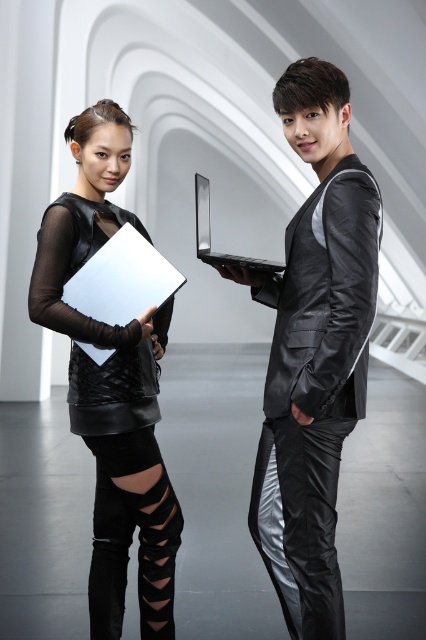
You are an interior designer observing the modern setting. You need to place a new decorative sculpture that requires a stable, flat surface. Which object between the shiny black leather jacket at center and the white matte clipboard at left would be the better choice for placing the sculpture?

The white matte clipboard at left is shorter than the shiny black leather jacket at center, making it more stable for placing the decorative sculpture.

Consider the image. You are a fashion designer observing the scene. You need to decide whether the matte black dress at left can be displayed on a mannequin next to the silver metallic laptop at center without the laptop being obscured. Can the dress and laptop be placed side by side?

The matte black dress at left might be wider than the silver metallic laptop at center, so there is a possibility that placing them side by side could result in the laptop being partially obscured depending on their exact widths. To ensure visibility, the dress should be positioned slightly behind or offset from the laptop.

You are designing a futuristic exhibition space and need to place the shiny black leather jacket at center and the silver metallic laptop at center on a display table. Given that the table has limited space, which object should you prioritize placing first to ensure both fit comfortably?

The shiny black leather jacket at center is larger in size than the silver metallic laptop at center, so you should prioritize placing the shiny black leather jacket at center first to ensure both objects fit comfortably on the table.